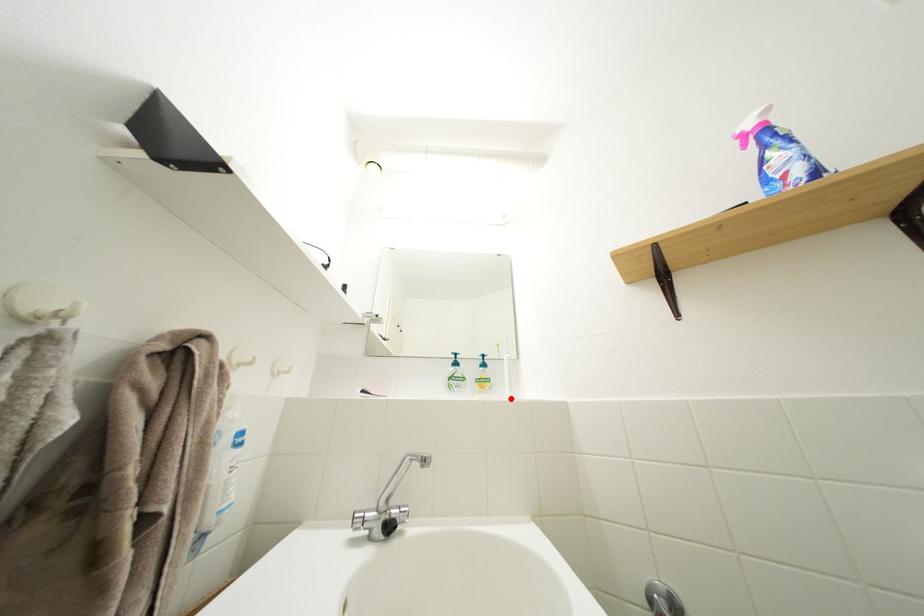
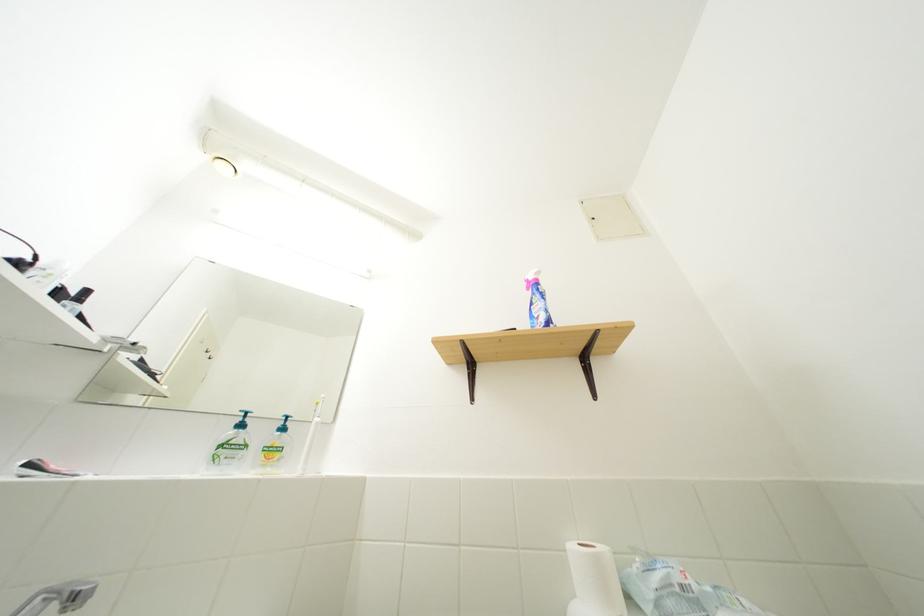
Locate, in the second image, the point that corresponds to the highlighted location in the first image.

(298, 474)